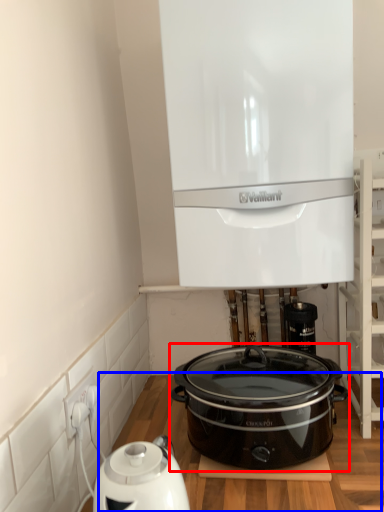
Question: Among these objects, which one is farthest to the camera, slow cooker (highlighted by a red box) or table (highlighted by a blue box)?

Choices:
 (A) slow cooker
 (B) table

Answer: (A)